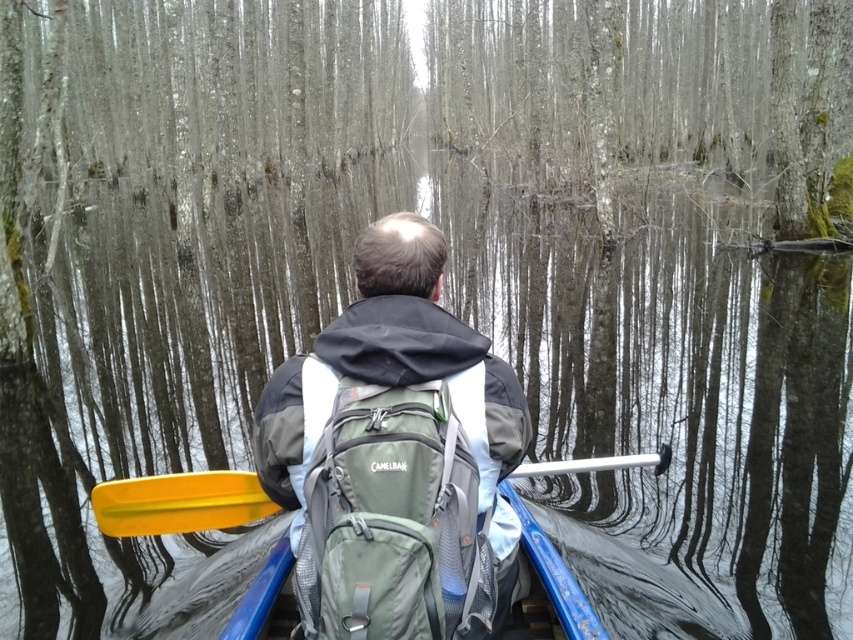
Question: Is green fabric backpack at center wider than yellow plastic paddle at lower left?

Choices:
 (A) no
 (B) yes

Answer: (A)

Question: Which object is closer to the camera taking this photo?

Choices:
 (A) green fabric backpack at center
 (B) blue plastic canoe at center
 (C) yellow plastic paddle at lower left

Answer: (A)

Question: Based on their relative distances, which object is nearer to the blue plastic canoe at center?

Choices:
 (A) yellow plastic paddle at lower left
 (B) green fabric backpack at center

Answer: (B)

Question: Is green fabric backpack at center bigger than blue plastic canoe at center?

Choices:
 (A) no
 (B) yes

Answer: (A)

Question: Which object is farther from the camera taking this photo?

Choices:
 (A) green fabric backpack at center
 (B) blue plastic canoe at center
 (C) yellow plastic paddle at lower left

Answer: (C)

Question: Does green fabric backpack at center appear over yellow plastic paddle at lower left?

Choices:
 (A) no
 (B) yes

Answer: (B)